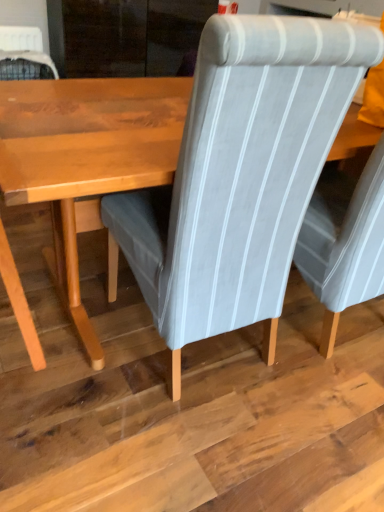
This screenshot has height=512, width=384. In order to click on free area below light gray fabric chair at center (from a real-world perspective) in this screenshot , I will do `click(190, 350)`.